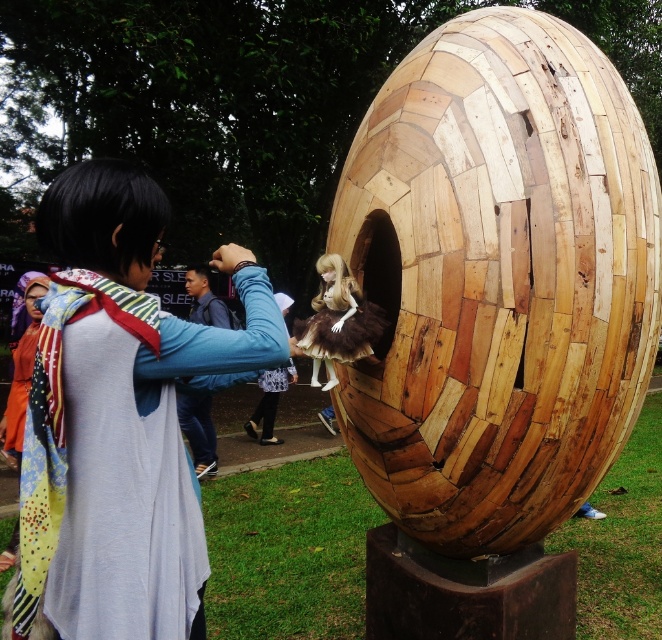
You are standing in front of the sculpture and want to take a photo that includes both the wooden egg at center and the multicolored scarf at left. Which object should you position closer to the left side of the frame to ensure both are visible?

The multicolored scarf at left should be positioned closer to the left side of the frame since the wooden egg at center is on the right side of the multicolored scarf at left, allowing both to fit within the frame.

You are a photographer trying to capture the multicolored scarf at left and the matte brown doll at center in your frame. Based on their positions, which object should you adjust your camera angle to focus on first if you want to include both in the shot?

The multicolored scarf at left is positioned on the left side of the matte brown doll at center, so you should focus on the matte brown doll at center first to ensure both fit in the frame.

You are standing at the point marked as point (389,332) and want to take a photo of the sculpture. The camera you have can only focus on objects within 7 feet. Will the sculpture be in focus?

The distance of point (389,332) from the camera is 7.56 feet, which is beyond the camera focus range of 7 feet. Therefore, the sculpture will not be in focus.